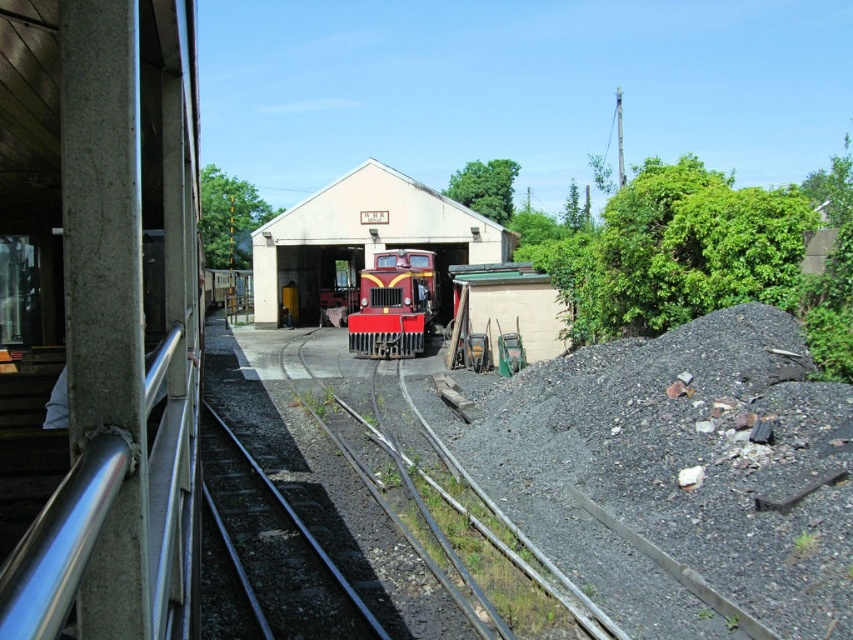
You are a railway engineer who needs to locate the matte red train at center on a coordinate grid. What are its coordinates?

The coordinates of the matte red train at center are at point (363, 240).